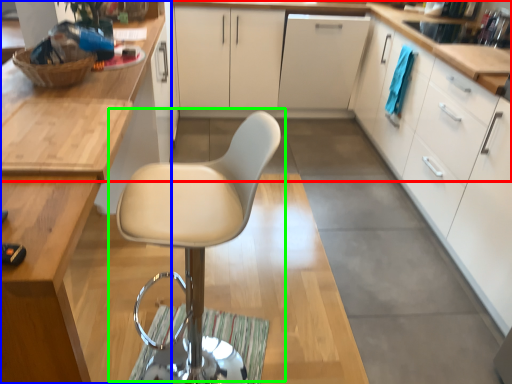
Question: Which object is positioned farthest from countertop (highlighted by a red box)? Select from cabinetry (highlighted by a blue box) and chair (highlighted by a green box).

Choices:
 (A) cabinetry
 (B) chair

Answer: (A)